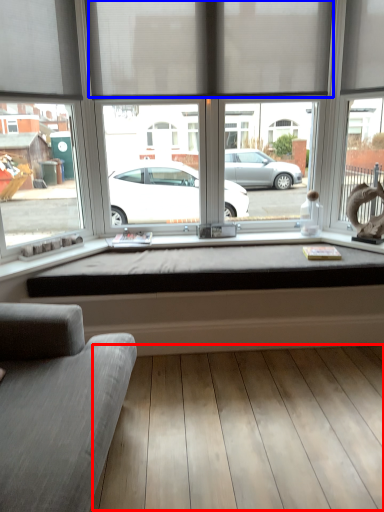
Question: Which object appears closest to the camera in this image, plank (highlighted by a red box) or curtain (highlighted by a blue box)?

Choices:
 (A) plank
 (B) curtain

Answer: (A)